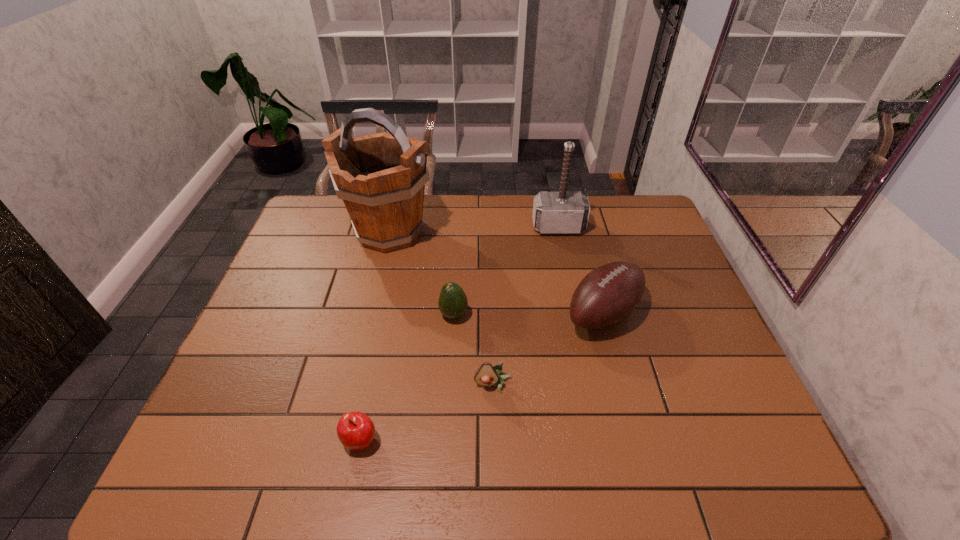
At what (x,y) coordinates should I click in order to perform the action: click on free space at the far left corner of the desktop. Please return your answer as a coordinate pair (x, y). Looking at the image, I should click on (328, 228).

Where is `free space between the third object from right to left and the second tallest object`? This screenshot has width=960, height=540. free space between the third object from right to left and the second tallest object is located at coordinates point(526,306).

Identify the location of vacant space in between the hammer and the nearest object. (460, 334).

Identify the location of vacant space that's between the second tallest object and the apple. The height and width of the screenshot is (540, 960). (460, 334).

Where is `free spot between the nearest object and the shorter avocado`? The height and width of the screenshot is (540, 960). free spot between the nearest object and the shorter avocado is located at coordinates pos(427,412).

Locate an element on the screen. vacant space that is in between the right avocado and the farther avocado is located at coordinates (473, 349).

Locate an element on the screen. The height and width of the screenshot is (540, 960). vacant space in between the right avocado and the football (American) is located at coordinates click(548, 349).

Where is `free space between the apple and the farther avocado`? The image size is (960, 540). free space between the apple and the farther avocado is located at coordinates (407, 377).

The width and height of the screenshot is (960, 540). Identify the location of the second closest object relative to the tallest object. (562, 212).

Where is `object that stands as the third closest to the second tallest object`? Image resolution: width=960 pixels, height=540 pixels. object that stands as the third closest to the second tallest object is located at coordinates (453, 303).